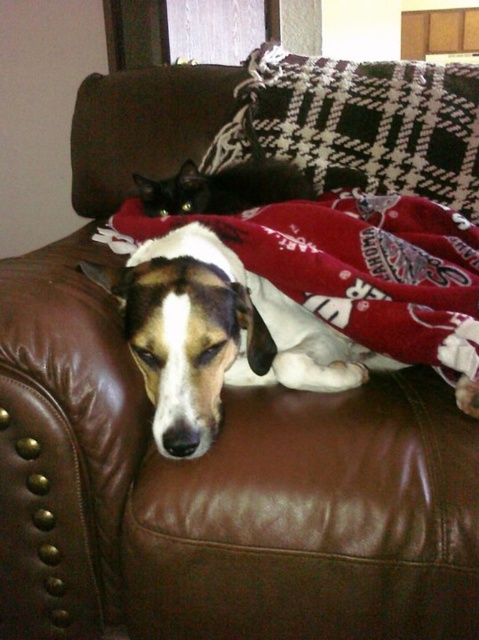
Question: Is red fleece blanket at center below plaid fabric pillow at upper center?

Choices:
 (A) yes
 (B) no

Answer: (A)

Question: Which of the following is the farthest from the observer?

Choices:
 (A) red fleece blanket at center
 (B) plaid fabric pillow at upper center

Answer: (B)

Question: Which point appears farthest from the camera in this image?

Choices:
 (A) (225, 227)
 (B) (239, 83)

Answer: (B)

Question: In this image, where is red fleece blanket at center located relative to plaid fabric pillow at upper center?

Choices:
 (A) below
 (B) above

Answer: (A)

Question: Is red fleece blanket at center to the left of plaid fabric pillow at upper center from the viewer's perspective?

Choices:
 (A) no
 (B) yes

Answer: (B)